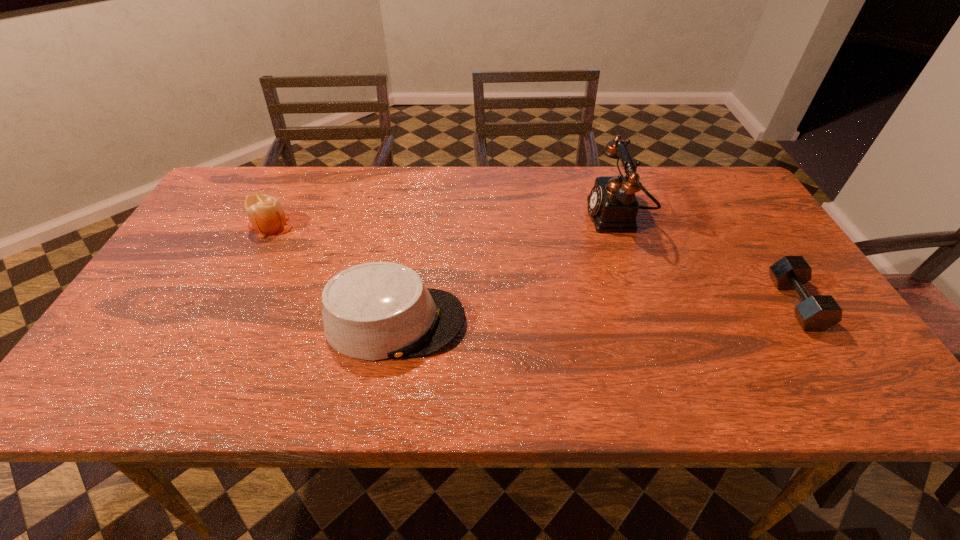
Identify the location of free space between the leftmost object and the tallest object. The image size is (960, 540). (444, 221).

You are a GUI agent. You are given a task and a screenshot of the screen. Output one action in this format:
    pyautogui.click(x=<x>, y=<y>)
    Task: Click on the empty location between the tallest object and the third object from right to left
    
    Given the screenshot: What is the action you would take?
    pyautogui.click(x=506, y=269)

You are a GUI agent. You are given a task and a screenshot of the screen. Output one action in this format:
    pyautogui.click(x=<x>, y=<y>)
    Task: Click on the free space that is in between the telephone and the shortest object
    Image resolution: width=960 pixels, height=540 pixels.
    Given the screenshot: What is the action you would take?
    pyautogui.click(x=706, y=260)

The width and height of the screenshot is (960, 540). I want to click on object that ranks as the second closest to the third object from right to left, so click(613, 206).

You are a GUI agent. You are given a task and a screenshot of the screen. Output one action in this format:
    pyautogui.click(x=<x>, y=<y>)
    Task: Click on the object that is the third closest to the dumbbell
    
    Given the screenshot: What is the action you would take?
    pyautogui.click(x=265, y=213)

Locate an element on the screen. vacant region that satisfies the following two spatial constraints: 1. on the front of the tallest object at the rotary dial; 2. on the left side of the dumbbell is located at coordinates (646, 303).

This screenshot has height=540, width=960. In order to click on free space in the image that satisfies the following two spatial constraints: 1. on the front of the shortest object at the rotary dial; 2. on the right side of the tallest object in this screenshot , I will do `click(646, 303)`.

The image size is (960, 540). I want to click on free space that satisfies the following two spatial constraints: 1. on the front of the tallest object at the rotary dial; 2. on the front side of the leftmost object, so click(x=619, y=225).

Where is `free space that satisfies the following two spatial constraints: 1. on the front of the telephone at the rotary dial; 2. on the left side of the rightmost object`? The height and width of the screenshot is (540, 960). free space that satisfies the following two spatial constraints: 1. on the front of the telephone at the rotary dial; 2. on the left side of the rightmost object is located at coordinates (646, 303).

Where is `vacant space that satisfies the following two spatial constraints: 1. on the back side of the rightmost object; 2. on the front of the second object from right to left at the rotary dial`? vacant space that satisfies the following two spatial constraints: 1. on the back side of the rightmost object; 2. on the front of the second object from right to left at the rotary dial is located at coordinates (739, 217).